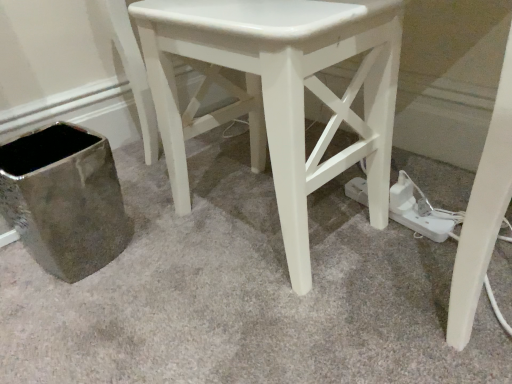
Question: Based on their positions, is white plastic plug at lower right located to the left or right of white glossy stool at center?

Choices:
 (A) left
 (B) right

Answer: (B)

Question: From a real-world perspective, relative to white glossy stool at center, is white plastic plug at lower right vertically above or below?

Choices:
 (A) above
 (B) below

Answer: (B)

Question: Is white plastic plug at lower right wider or thinner than white glossy stool at center?

Choices:
 (A) wide
 (B) thin

Answer: (B)

Question: Considering the relative positions of white glossy stool at center and white plastic plug at lower right in the image provided, is white glossy stool at center to the left or to the right of white plastic plug at lower right?

Choices:
 (A) right
 (B) left

Answer: (B)

Question: In terms of height, does white glossy stool at center look taller or shorter compared to white plastic plug at lower right?

Choices:
 (A) tall
 (B) short

Answer: (A)

Question: From the image's perspective, is white glossy stool at center positioned above or below white plastic plug at lower right?

Choices:
 (A) below
 (B) above

Answer: (B)

Question: Do you think white glossy stool at center is within white plastic plug at lower right, or outside of it?

Choices:
 (A) outside
 (B) inside

Answer: (A)